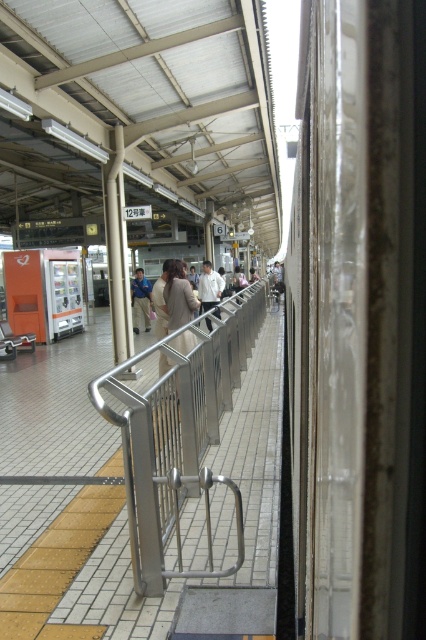
Question: Can you confirm if silver metallic rail at center is bigger than light beige fabric jacket at center?

Choices:
 (A) no
 (B) yes

Answer: (B)

Question: Does silver metallic rail at center appear on the left side of white shirt at center?

Choices:
 (A) yes
 (B) no

Answer: (B)

Question: Does light brown fabric coat at center appear over white shirt at center?

Choices:
 (A) yes
 (B) no

Answer: (B)

Question: Among these points, which one is farthest from the camera?

Choices:
 (A) (180, 317)
 (B) (143, 288)
 (C) (203, 305)

Answer: (B)

Question: Which of the following is the farthest from the observer?

Choices:
 (A) silver metallic rail at center
 (B) white shirt at center
 (C) light beige fabric jacket at center
 (D) light brown fabric coat at center

Answer: (C)

Question: Which point is closer to the camera?

Choices:
 (A) (146, 300)
 (B) (192, 314)
 (C) (215, 280)
 (D) (181, 502)

Answer: (D)